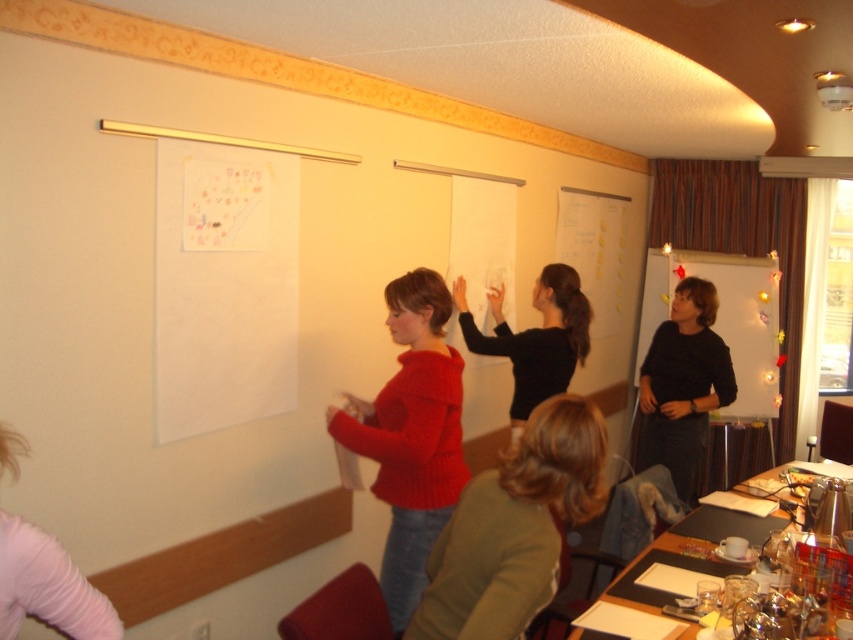
You are a person who needs to pass a notebook from the knitted red sweater at center to the black matte sweater at right. The notebook is 0.2 meters thick. Can you hand it directly without needing to move closer?

The distance between the knitted red sweater at center and the black matte sweater at right is 1.96 meters. Since the notebook is only 0.2 meters thick, you would need to move closer to bridge the gap of approximately 1.76 meters to hand it directly.

You are standing at the entrance of the room and see the knitted red sweater at center. If you want to reach it in 3 steps, each step being 0.7 meters, will you be able to do so?

The knitted red sweater at center is 2.13 meters from the viewer. Since each step is 0.7 meters, 3 steps would cover 2.1 meters. The distance is slightly more than 2.1 meters, so you would need an additional step to reach it.

You are organizing a workshop and need to seat participants around a table. The table has a width of 1.2 meters. If the knitted red sweater at center and the black matte sweater at right are sitting side by side, will they fit comfortably without overlapping?

The knitted red sweater at center has a larger width than the black matte sweater at right. However, the combined width of both individuals would need to be less than 1.2 meters to fit comfortably. Since the exact widths are not provided, we cannot determine if they will fit without overlapping. Please provide more specific measurements for an accurate assessment.